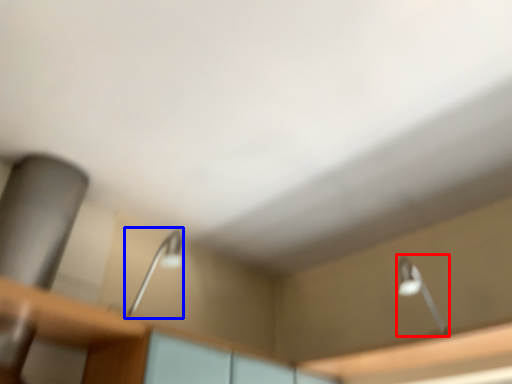
Question: Which of the following is the farthest to the observer, lamp (highlighted by a red box) or lamp (highlighted by a blue box)?

Choices:
 (A) lamp
 (B) lamp

Answer: (A)